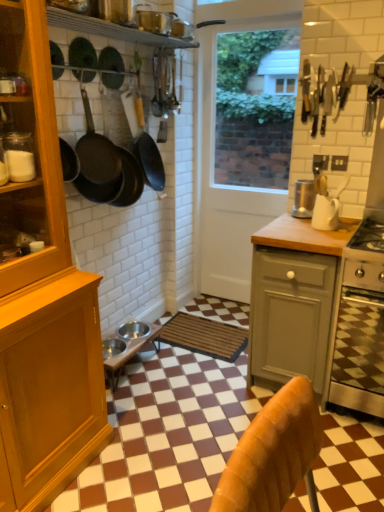
At what (x,y) coordinates should I click in order to perform the action: click on metallic silver bowls at center. Please return your answer as a coordinate pair (x, y). This screenshot has height=512, width=384. Looking at the image, I should click on (127, 347).

What do you see at coordinates (97, 154) in the screenshot? I see `black matte frying pan at upper left, arranged as the 3th frying pan when viewed from the back` at bounding box center [97, 154].

Where is `wooden at right`? The height and width of the screenshot is (512, 384). wooden at right is located at coordinates [x=300, y=309].

Measure the distance between point (321, 200) and camera.

The distance of point (321, 200) from camera is 7.14 feet.

The width and height of the screenshot is (384, 512). What do you see at coordinates (304, 198) in the screenshot? I see `satin silver blender at center, marked as the 2th kitchen appliance in a front-to-back arrangement` at bounding box center [304, 198].

Find the location of `matte black frying pan at upper left, the 2th frying pan when ordered from front to back`. matte black frying pan at upper left, the 2th frying pan when ordered from front to back is located at coordinates (106, 167).

From the image's perspective, relative to satin silver blender at center, which ranks as the first kitchen appliance in back-to-front order, is brown woven mat at center above or below?

Clearly, from the image's perspective, brown woven mat at center is below satin silver blender at center, which ranks as the first kitchen appliance in back-to-front order.

Does point (190, 329) appear closer or farther from the camera than point (294, 198)?

Clearly, point (190, 329) is more distant from the camera than point (294, 198).

Could you measure the distance between brown woven mat at center and satin silver blender at center, which ranks as the first kitchen appliance in back-to-front order?

They are 1.01 meters apart.

From a real-world perspective, which object stands above the other?

satin silver blender at center, marked as the 2th kitchen appliance in a front-to-back arrangement, is physically above.

Which is less distant, [85,102] or [333,210]?

Point [85,102].

Considering the relative sizes of matte black frying pan at upper left, the 2th frying pan when ordered from front to back, and white matte mug at upper right, positioned as the first kitchen appliance in front-to-back order, in the image provided, is matte black frying pan at upper left, the 2th frying pan when ordered from front to back, shorter than white matte mug at upper right, positioned as the first kitchen appliance in front-to-back order,?

In fact, matte black frying pan at upper left, the 2th frying pan when ordered from front to back, may be taller than white matte mug at upper right, positioned as the first kitchen appliance in front-to-back order.

Which object is thinner, matte black frying pan at upper left, the 2th frying pan when ordered from front to back, or white matte mug at upper right, the 2th kitchen appliance positioned from the back?

With smaller width is matte black frying pan at upper left, the 2th frying pan when ordered from front to back.

Is the surface of matte black frying pan at upper left, which ranks as the 2th frying pan in back-to-front order, in direct contact with white matte mug at upper right, the 2th kitchen appliance positioned from the back?

No, matte black frying pan at upper left, which ranks as the 2th frying pan in back-to-front order, is not with white matte mug at upper right, the 2th kitchen appliance positioned from the back.

In the scene shown: Is brown woven mat at center inside white glossy door at center?

No, white glossy door at center does not contain brown woven mat at center.

Can you confirm if white glossy door at center is taller than brown woven mat at center?

Correct, white glossy door at center is much taller as brown woven mat at center.

Is point (249, 234) closer to camera compared to point (247, 332)?

No.

From the image's perspective, is white glossy door at center below brown woven mat at center?

Incorrect, from the image's perspective, white glossy door at center is higher than brown woven mat at center.

Is stainless steel oven at lower right turned away from satin silver blender at center, which ranks as the first kitchen appliance in back-to-front order?

No, satin silver blender at center, which ranks as the first kitchen appliance in back-to-front order, is not at the back of stainless steel oven at lower right.

Are stainless steel oven at lower right and satin silver blender at center, marked as the 2th kitchen appliance in a front-to-back arrangement, far apart?

No, there isn't a large distance between stainless steel oven at lower right and satin silver blender at center, marked as the 2th kitchen appliance in a front-to-back arrangement.

Which point is more distant from viewer, (365, 275) or (309, 183)?

Positioned behind is point (309, 183).

Is wooden cabinet at left placed right next to wooden at right?

There is a gap between wooden cabinet at left and wooden at right.

In the scene shown: From the image's perspective, would you say wooden cabinet at left is positioned over wooden at right?

Yes.

Locate an element on the screen. Image resolution: width=384 pixels, height=512 pixels. cabinetry lying above the wooden at right (from the image's perspective) is located at coordinates (43, 296).

Which is behind, point (48, 252) or point (290, 284)?

The point (290, 284) is behind.

Which of these two, wooden at right or white matte mug at upper right, the 2th kitchen appliance positioned from the back, is smaller?

Smaller between the two is white matte mug at upper right, the 2th kitchen appliance positioned from the back.

Could you measure the distance between wooden at right and white matte mug at upper right, the 2th kitchen appliance positioned from the back?

A distance of 18.98 inches exists between wooden at right and white matte mug at upper right, the 2th kitchen appliance positioned from the back.

From the image's perspective, is wooden at right located above or below white matte mug at upper right, positioned as the first kitchen appliance in front-to-back order?

Based on their image positions, wooden at right is located beneath white matte mug at upper right, positioned as the first kitchen appliance in front-to-back order.

Is wooden at right taller or shorter than white matte mug at upper right, the 2th kitchen appliance positioned from the back?

In the image, wooden at right appears to be taller than white matte mug at upper right, the 2th kitchen appliance positioned from the back.

From a real-world perspective, which object rests below the other?

stainless steel oven at lower right.

Considering the sizes of objects matte black frying pan at upper left, the 2th frying pan when ordered from front to back, and stainless steel oven at lower right in the image provided, who is thinner, matte black frying pan at upper left, the 2th frying pan when ordered from front to back, or stainless steel oven at lower right?

With smaller width is matte black frying pan at upper left, the 2th frying pan when ordered from front to back.

The image size is (384, 512). In order to click on the 2nd frying pan to the left when counting from the stainless steel oven at lower right in this screenshot , I will do [x=106, y=167].

Considering the relative sizes of matte black frying pan at upper left, the 2th frying pan when ordered from front to back, and stainless steel oven at lower right in the image provided, is matte black frying pan at upper left, the 2th frying pan when ordered from front to back, taller than stainless steel oven at lower right?

Incorrect, the height of matte black frying pan at upper left, the 2th frying pan when ordered from front to back, is not larger of that of stainless steel oven at lower right.

Where is `kitchen appliance that is the 2nd object above the brown woven mat at center (from a real-world perspective)`? The height and width of the screenshot is (512, 384). kitchen appliance that is the 2nd object above the brown woven mat at center (from a real-world perspective) is located at coordinates (304, 198).

Locate an element on the screen. kitchen appliance that is the 2nd one below the matte black frying pan at upper left, the 2th frying pan when ordered from front to back (from a real-world perspective) is located at coordinates (325, 213).

Estimate the real-world distances between objects in this image. Which object is further from black matte frying pan at upper center, the 3th frying pan from the front, white glossy door at center or stainless steel oven at lower right?

stainless steel oven at lower right lies further to black matte frying pan at upper center, the 3th frying pan from the front, than the other object.

Considering their positions, is matte black frying pan at upper left, the 2th frying pan when ordered from front to back, positioned further to wooden cabinet at left than white matte mug at upper right, the 2th kitchen appliance positioned from the back?

white matte mug at upper right, the 2th kitchen appliance positioned from the back.

From the image, which object appears to be farther from stainless steel oven at lower right, matte black frying pan at upper left, which ranks as the 2th frying pan in back-to-front order, or wooden at right?

Among the two, matte black frying pan at upper left, which ranks as the 2th frying pan in back-to-front order, is located further to stainless steel oven at lower right.

Based on their spatial positions, is wooden at right or wooden cabinet at left further from black matte frying pan at upper center, which ranks as the first frying pan in back-to-front order?

wooden at right.

From the image, which object appears to be nearer to metallic silver bowls at center, matte black frying pan at upper left, the 2th frying pan when ordered from front to back, or black matte frying pan at upper left, arranged as the 1th frying pan when viewed from the front?

Among the two, matte black frying pan at upper left, the 2th frying pan when ordered from front to back, is located nearer to metallic silver bowls at center.

From the image, which object appears to be farther from white glossy door at center, white matte mug at upper right, the 2th kitchen appliance positioned from the back, or metallic silver bowls at center?

Based on the image, metallic silver bowls at center appears to be further to white glossy door at center.

Based on their spatial positions, is wooden at right or satin silver blender at center, marked as the 2th kitchen appliance in a front-to-back arrangement, further from brown woven mat at center?

Among the two, satin silver blender at center, marked as the 2th kitchen appliance in a front-to-back arrangement, is located further to brown woven mat at center.

Based on their spatial positions, is black matte frying pan at upper left, arranged as the 1th frying pan when viewed from the front, or metallic silver bowls at center closer to matte black frying pan at upper left, which ranks as the 2th frying pan in back-to-front order?

Based on the image, black matte frying pan at upper left, arranged as the 1th frying pan when viewed from the front, appears to be nearer to matte black frying pan at upper left, which ranks as the 2th frying pan in back-to-front order.

Find the location of a particular element. screen door between matte black frying pan at upper left, the 2th frying pan when ordered from front to back, and metallic silver bowls at center from top to bottom is located at coordinates (233, 165).

Locate an element on the screen. The width and height of the screenshot is (384, 512). screen door between black matte frying pan at upper center, the 3th frying pan from the front, and white matte mug at upper right, positioned as the first kitchen appliance in front-to-back order is located at coordinates (233, 165).

Locate an element on the screen. This screenshot has width=384, height=512. countertop located between black matte frying pan at upper left, arranged as the 1th frying pan when viewed from the front, and white matte mug at upper right, the 2th kitchen appliance positioned from the back, in the left-right direction is located at coordinates (300, 309).

This screenshot has width=384, height=512. I want to click on mat between wooden cabinet at left and satin silver blender at center, marked as the 2th kitchen appliance in a front-to-back arrangement, so click(x=204, y=336).